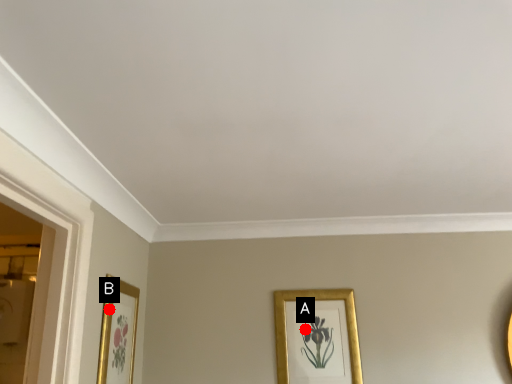
Question: Two points are circled on the image, labeled by A and B beside each circle. Which point is closer to the camera?

Choices:
 (A) A is closer
 (B) B is closer

Answer: (B)